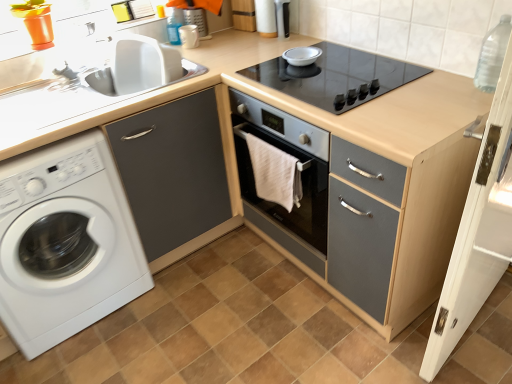
Question: Is white matte washing machine at left thinner than matte gray cabinet at center?

Choices:
 (A) yes
 (B) no

Answer: (B)

Question: Is white matte washing machine at left outside matte gray cabinet at center?

Choices:
 (A) yes
 (B) no

Answer: (A)

Question: Is white matte washing machine at left facing away from matte gray cabinet at center?

Choices:
 (A) no
 (B) yes

Answer: (A)

Question: Is there a large distance between white matte washing machine at left and matte gray cabinet at center?

Choices:
 (A) yes
 (B) no

Answer: (B)

Question: Is matte gray cabinet at center completely or partially inside white matte washing machine at left?

Choices:
 (A) yes
 (B) no

Answer: (B)

Question: Would you say matte gray cabinet at center is to the left or to the right of white glossy sink at upper left in the picture?

Choices:
 (A) left
 (B) right

Answer: (B)

Question: In terms of width, does matte gray cabinet at center look wider or thinner when compared to white glossy sink at upper left?

Choices:
 (A) wide
 (B) thin

Answer: (A)

Question: Does point (381, 150) appear closer or farther from the camera than point (144, 59)?

Choices:
 (A) closer
 (B) farther

Answer: (A)

Question: Relative to white glossy sink at upper left, is matte gray cabinet at center in front or behind?

Choices:
 (A) front
 (B) behind

Answer: (A)

Question: Does point (273, 59) appear closer or farther from the camera than point (209, 240)?

Choices:
 (A) farther
 (B) closer

Answer: (B)

Question: Would you say black glass cooktop at center is inside or outside matte gray cabinet at left?

Choices:
 (A) inside
 (B) outside

Answer: (B)

Question: Based on their sizes in the image, would you say black glass cooktop at center is bigger or smaller than matte gray cabinet at left?

Choices:
 (A) big
 (B) small

Answer: (B)

Question: From a real-world perspective, relative to matte gray cabinet at left, is black glass cooktop at center vertically above or below?

Choices:
 (A) below
 (B) above

Answer: (B)

Question: From a real-world perspective, relative to white glossy sink at upper left, is white wood screen door at right vertically above or below?

Choices:
 (A) below
 (B) above

Answer: (A)

Question: In terms of height, does white wood screen door at right look taller or shorter compared to white glossy sink at upper left?

Choices:
 (A) tall
 (B) short

Answer: (A)